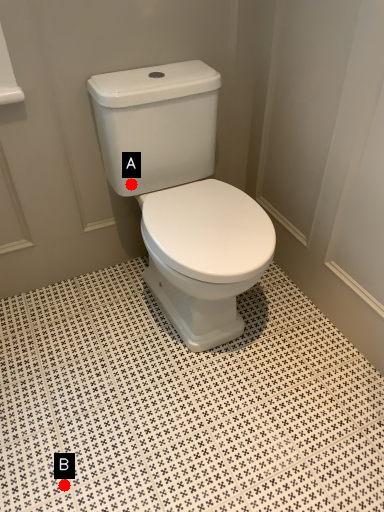
Question: Two points are circled on the image, labeled by A and B beside each circle. Which point is further to the camera?

Choices:
 (A) A is further
 (B) B is further

Answer: (A)